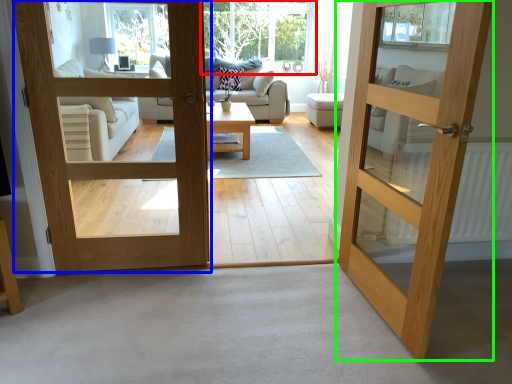
Question: Which object is positioned farthest from window (highlighted by a red box)? Select from door (highlighted by a blue box) and door (highlighted by a green box).

Choices:
 (A) door
 (B) door

Answer: (B)